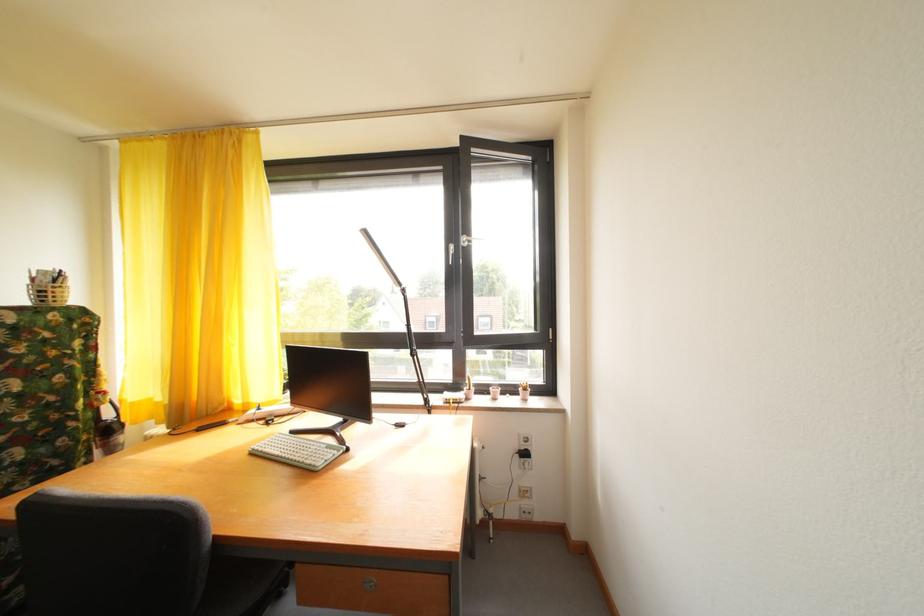
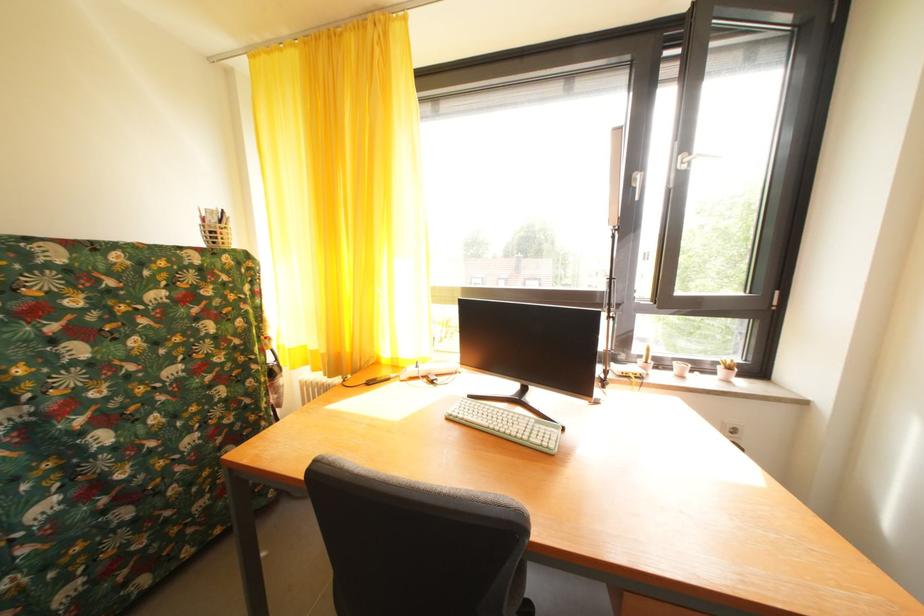
Find the pixel in the second image that matches pixel 529 395 in the first image.

(728, 374)